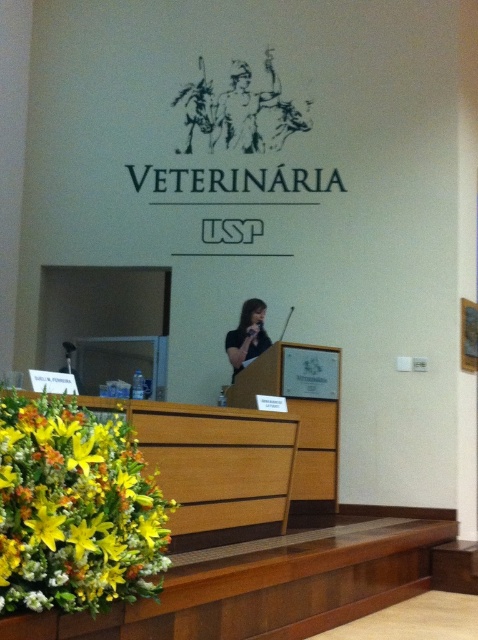
You are standing in the conference room and want to take a photo of the logo on the wall. The camera you have can only focus on objects within 10 feet. Is the point at coordinates point (x=88, y=428) within the camera focus range?

The point at coordinates point (x=88, y=428) is 9.38 feet from the camera, which is within the camera focus range of 10 feet. Therefore, the camera can focus on that point.

You are attending a veterinary conference at USP and notice two points marked in the room. The first point is at coordinate point (141,522) and the second is at point (259,305). Which point is closer to you as you sit in the audience?

Point (141,522) is closer to the viewer than point (259,305).

You are organizing a photo shoot for a veterinary conference and need to ensure that all elements are properly framed. Given the scene described, can the vibrant floral arrangement at lower left and the black matte shirt at center be captured in a single shot without cropping either object?

The vibrant floral arrangement at lower left is bigger than the black matte shirt at center, so it may require adjusting the camera angle or zoom to ensure both objects fit within the frame without cropping. However, since the floral arrangement is larger, it might dominate the shot, so positioning the camera appropriately would be necessary.